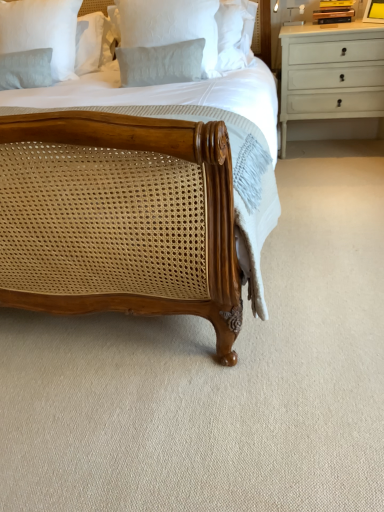
How much space does white textured pillow at upper center, placed as the first pillow when sorted from right to left, occupy horizontally?

5.86 inches.

What do you see at coordinates (42, 31) in the screenshot?
I see `light gray textured pillow at upper left, which is the second pillow from right to left` at bounding box center [42, 31].

I want to click on white textured pillow at upper center, placed as the first pillow when sorted from right to left, so click(171, 26).

Are white painted wood chest of drawers at upper right and light gray textured pillow at upper left, the 2th pillow positioned from the front, beside each other?

white painted wood chest of drawers at upper right is not next to light gray textured pillow at upper left, the 2th pillow positioned from the front, and they're not touching.

Is white painted wood chest of drawers at upper right closer to the viewer compared to light gray textured pillow at upper left, arranged as the 1th pillow when viewed from the back?

That is False.

From the image's perspective, does white painted wood chest of drawers at upper right appear lower than light gray textured pillow at upper left, the 2th pillow positioned from the front?

Yes, from the image's perspective, white painted wood chest of drawers at upper right is below light gray textured pillow at upper left, the 2th pillow positioned from the front.

From the picture: Who is smaller, yellow matte picture frame at upper right or white textured pillow at upper center, the second pillow positioned from the left?

yellow matte picture frame at upper right is smaller.

Is yellow matte picture frame at upper right facing away from white textured pillow at upper center, the 1th pillow positioned from the front?

That's not correct — yellow matte picture frame at upper right is not looking away from white textured pillow at upper center, the 1th pillow positioned from the front.

Considering their positions, is yellow matte picture frame at upper right located in front of or behind white textured pillow at upper center, placed as the first pillow when sorted from right to left?

Visually, yellow matte picture frame at upper right is located behind white textured pillow at upper center, placed as the first pillow when sorted from right to left.

Are yellow matte picture frame at upper right and white textured pillow at upper center, the second pillow positioned from the left, far apart?

yellow matte picture frame at upper right is positioned a significant distance from white textured pillow at upper center, the second pillow positioned from the left.

From the image's perspective, between white painted wood chest of drawers at upper right and white textured pillow at upper center, the 1th pillow positioned from the front, who is located below?

white textured pillow at upper center, the 1th pillow positioned from the front.

Is white painted wood chest of drawers at upper right taller or shorter than white textured pillow at upper center, placed as the first pillow when sorted from right to left?

Clearly, white painted wood chest of drawers at upper right is taller compared to white textured pillow at upper center, placed as the first pillow when sorted from right to left.

Is white painted wood chest of drawers at upper right positioned with its back to white textured pillow at upper center, which is counted as the 2th pillow, starting from the back?

No, white painted wood chest of drawers at upper right's orientation is not away from white textured pillow at upper center, which is counted as the 2th pillow, starting from the back.

Is white painted wood chest of drawers at upper right to the left of white textured pillow at upper center, placed as the first pillow when sorted from right to left, from the viewer's perspective?

In fact, white painted wood chest of drawers at upper right is to the right of white textured pillow at upper center, placed as the first pillow when sorted from right to left.

Would you say white textured pillow at upper center, the second pillow positioned from the left, contains white painted wood chest of drawers at upper right?

No, white painted wood chest of drawers at upper right is not inside white textured pillow at upper center, the second pillow positioned from the left.

Can you tell me how much white textured pillow at upper center, which is counted as the 2th pillow, starting from the back, and white painted wood chest of drawers at upper right differ in facing direction?

The angle between the facing direction of white textured pillow at upper center, which is counted as the 2th pillow, starting from the back, and the facing direction of white painted wood chest of drawers at upper right is 4.83 degrees.

From the image's perspective, is white textured pillow at upper center, the 1th pillow positioned from the front, above white painted wood chest of drawers at upper right?

No, from the image's perspective, white textured pillow at upper center, the 1th pillow positioned from the front, is not over white painted wood chest of drawers at upper right.

From a real-world perspective, which object rests below the other?

From a 3D spatial view, white painted wood chest of drawers at upper right is below.

Based on the photo, from their relative heights in the image, would you say yellow matte picture frame at upper right is taller or shorter than white painted wood chest of drawers at upper right?

yellow matte picture frame at upper right is shorter than white painted wood chest of drawers at upper right.

Looking at their sizes, would you say yellow matte picture frame at upper right is wider or thinner than white painted wood chest of drawers at upper right?

Considering their sizes, yellow matte picture frame at upper right looks slimmer than white painted wood chest of drawers at upper right.

Is yellow matte picture frame at upper right oriented away from white painted wood chest of drawers at upper right?

No, yellow matte picture frame at upper right is not facing the opposite direction of white painted wood chest of drawers at upper right.

Considering the positions of point (371, 19) and point (60, 72), is point (371, 19) closer or farther from the camera than point (60, 72)?

Clearly, point (371, 19) is closer to the camera than point (60, 72).

From a real-world perspective, between yellow matte picture frame at upper right and light gray textured pillow at upper left, arranged as the 1th pillow when viewed from the back, who is vertically lower?

From a 3D spatial view, light gray textured pillow at upper left, arranged as the 1th pillow when viewed from the back, is below.

Which is correct: yellow matte picture frame at upper right is inside light gray textured pillow at upper left, arranged as the 1th pillow when viewed from the back, or outside of it?

yellow matte picture frame at upper right is located beyond the bounds of light gray textured pillow at upper left, arranged as the 1th pillow when viewed from the back.

Considering the positions of objects light gray textured pillow at upper left, the 2th pillow positioned from the front, and yellow matte picture frame at upper right in the image provided, who is in front, light gray textured pillow at upper left, the 2th pillow positioned from the front, or yellow matte picture frame at upper right?

light gray textured pillow at upper left, the 2th pillow positioned from the front, is closer to the camera.

Can we say light gray textured pillow at upper left, arranged as the 1th pillow when viewed from the back, lies outside yellow matte picture frame at upper right?

light gray textured pillow at upper left, arranged as the 1th pillow when viewed from the back, is positioned outside yellow matte picture frame at upper right.

From the image's perspective, between light gray textured pillow at upper left, which is the second pillow from right to left, and yellow matte picture frame at upper right, who is located below?

light gray textured pillow at upper left, which is the second pillow from right to left, appears lower in the image.

At what (x,y) coordinates should I click in order to perform the action: click on the 1st pillow in front of the white painted wood chest of drawers at upper right. Please return your answer as a coordinate pair (x, y). Looking at the image, I should click on (42, 31).

The width and height of the screenshot is (384, 512). I want to click on picture frame above the white textured pillow at upper center, the 1th pillow positioned from the front (from a real-world perspective), so click(x=374, y=11).

Estimate the real-world distances between objects in this image. Which object is further from light gray textured pillow at upper left, positioned as the first pillow in left-to-right order, yellow matte picture frame at upper right or white painted wood chest of drawers at upper right?

Based on the image, yellow matte picture frame at upper right appears to be further to light gray textured pillow at upper left, positioned as the first pillow in left-to-right order.

Estimate the real-world distances between objects in this image. Which object is further from light gray textured pillow at upper left, which is the second pillow from right to left, white painted wood chest of drawers at upper right or white textured pillow at upper center, the second pillow positioned from the left?

The object further to light gray textured pillow at upper left, which is the second pillow from right to left, is white painted wood chest of drawers at upper right.

When comparing their distances from yellow matte picture frame at upper right, does white textured pillow at upper center, the second pillow positioned from the left, or light gray textured pillow at upper left, which is the second pillow from right to left, seem closer?

white textured pillow at upper center, the second pillow positioned from the left, lies closer to yellow matte picture frame at upper right than the other object.

Looking at the image, which one is located closer to yellow matte picture frame at upper right, light gray textured pillow at upper left, arranged as the 1th pillow when viewed from the back, or white textured pillow at upper center, placed as the first pillow when sorted from right to left?

Among the two, white textured pillow at upper center, placed as the first pillow when sorted from right to left, is located nearer to yellow matte picture frame at upper right.

Looking at the image, which one is located further to white textured pillow at upper center, the 1th pillow positioned from the front, yellow matte picture frame at upper right or white painted wood chest of drawers at upper right?

Based on the image, yellow matte picture frame at upper right appears to be further to white textured pillow at upper center, the 1th pillow positioned from the front.

Considering their positions, is white textured pillow at upper center, placed as the first pillow when sorted from right to left, positioned closer to yellow matte picture frame at upper right than white painted wood chest of drawers at upper right?

Among the two, white painted wood chest of drawers at upper right is located nearer to yellow matte picture frame at upper right.

Based on their spatial positions, is light gray textured pillow at upper left, the 2th pillow positioned from the front, or white textured pillow at upper center, placed as the first pillow when sorted from right to left, further from white painted wood chest of drawers at upper right?

light gray textured pillow at upper left, the 2th pillow positioned from the front, is positioned further to the anchor white painted wood chest of drawers at upper right.

Based on their spatial positions, is light gray textured pillow at upper left, which is the second pillow from right to left, or yellow matte picture frame at upper right further from white textured pillow at upper center, which is counted as the 2th pillow, starting from the back?

yellow matte picture frame at upper right lies further to white textured pillow at upper center, which is counted as the 2th pillow, starting from the back, than the other object.

This screenshot has height=512, width=384. In order to click on pillow between light gray textured pillow at upper left, positioned as the first pillow in left-to-right order, and white painted wood chest of drawers at upper right, in the horizontal direction in this screenshot , I will do (171, 26).

The height and width of the screenshot is (512, 384). In order to click on chest of drawers between light gray textured pillow at upper left, arranged as the 1th pillow when viewed from the back, and yellow matte picture frame at upper right, in the horizontal direction in this screenshot , I will do `click(331, 72)`.

The height and width of the screenshot is (512, 384). Find the location of `pillow situated between light gray textured pillow at upper left, positioned as the first pillow in left-to-right order, and yellow matte picture frame at upper right from left to right`. pillow situated between light gray textured pillow at upper left, positioned as the first pillow in left-to-right order, and yellow matte picture frame at upper right from left to right is located at coordinates (171, 26).

I want to click on the chest of drawers situated between white textured pillow at upper center, which is counted as the 2th pillow, starting from the back, and yellow matte picture frame at upper right from left to right, so click(331, 72).